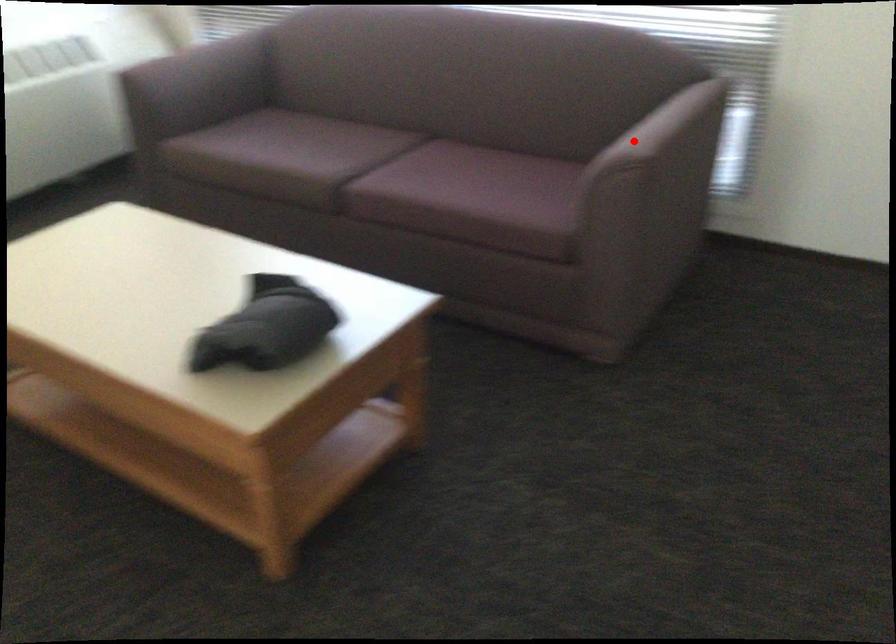
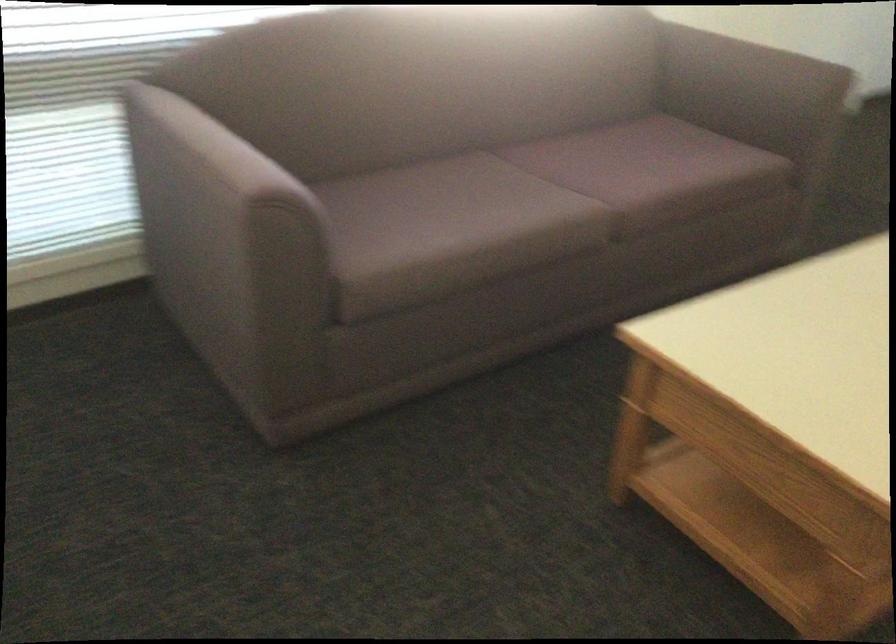
The point at the highlighted location is marked in the first image. Where is the corresponding point in the second image?

(746, 73)